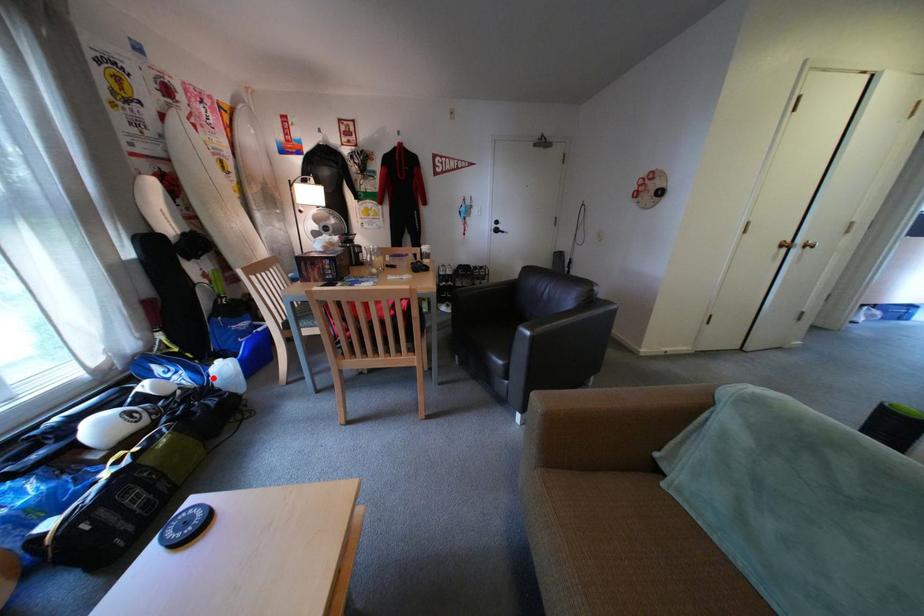
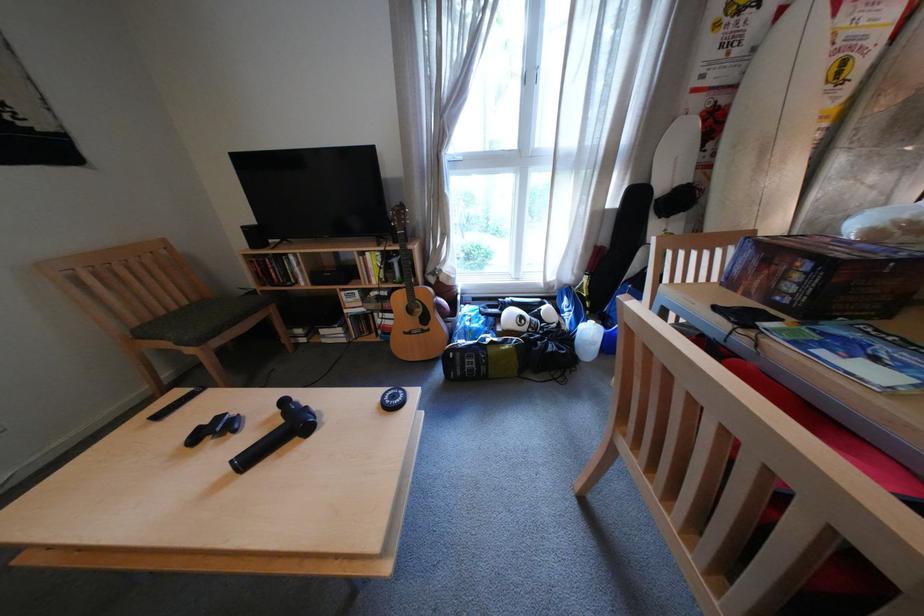
Question: A red point is marked in image1. In image2, is the corresponding 3D point closer to the camera or farther? Reply with the corresponding letter.

Choices:
 (A) The corresponding 3D point is closer.
 (B) The corresponding 3D point is farther.

Answer: (B)